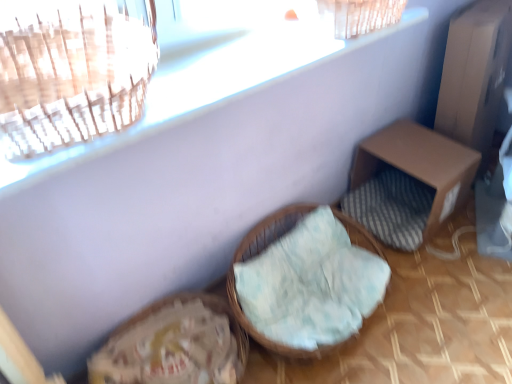
Question: From the image's perspective, is brown cardboard box at right, the second furniture from the left, located beneath woven wicker basket at center, the 1th furniture in the left-to-right sequence?

Choices:
 (A) no
 (B) yes

Answer: (A)

Question: Is brown cardboard box at right, the second furniture from the left, behind woven wicker basket at center, the 1th furniture in the left-to-right sequence?

Choices:
 (A) yes
 (B) no

Answer: (A)

Question: From a real-world perspective, is brown cardboard box at right, the 1th furniture from the right, on woven wicker basket at center, which is counted as the second furniture, starting from the right?

Choices:
 (A) yes
 (B) no

Answer: (A)

Question: Is brown cardboard box at right, the 1th furniture from the right, located outside woven wicker basket at center, which is counted as the second furniture, starting from the right?

Choices:
 (A) yes
 (B) no

Answer: (A)

Question: Is brown cardboard box at right, the 1th furniture from the right, wider than woven wicker basket at center, which is counted as the second furniture, starting from the right?

Choices:
 (A) no
 (B) yes

Answer: (A)

Question: Can you confirm if brown cardboard box at right, the second furniture from the left, is bigger than woven wicker basket at center, which is counted as the second furniture, starting from the right?

Choices:
 (A) no
 (B) yes

Answer: (B)

Question: From a real-world perspective, does woven wicker basket at center, the 1th furniture in the left-to-right sequence, sit lower than brown cardboard box at right, the second furniture from the left?

Choices:
 (A) no
 (B) yes

Answer: (B)

Question: Is woven wicker basket at center, the 1th furniture in the left-to-right sequence, facing away from brown cardboard box at right, the second furniture from the left?

Choices:
 (A) yes
 (B) no

Answer: (B)

Question: Is woven wicker basket at center, the 1th furniture in the left-to-right sequence, at the left side of brown cardboard box at right, the second furniture from the left?

Choices:
 (A) yes
 (B) no

Answer: (A)

Question: Is brown cardboard box at right, the second furniture from the left, inside woven wicker basket at center, which is counted as the second furniture, starting from the right?

Choices:
 (A) yes
 (B) no

Answer: (B)

Question: Can you confirm if woven wicker basket at center, the 1th furniture in the left-to-right sequence, is thinner than brown cardboard box at right, the 1th furniture from the right?

Choices:
 (A) no
 (B) yes

Answer: (A)

Question: From a real-world perspective, is woven wicker basket at center, the 1th furniture in the left-to-right sequence, physically above brown cardboard box at right, the 1th furniture from the right?

Choices:
 (A) yes
 (B) no

Answer: (B)

Question: From a real-world perspective, relative to brown cardboard box at right, the second furniture from the left, is woven wicker basket at center, the 1th furniture in the left-to-right sequence, vertically above or below?

Choices:
 (A) below
 (B) above

Answer: (A)